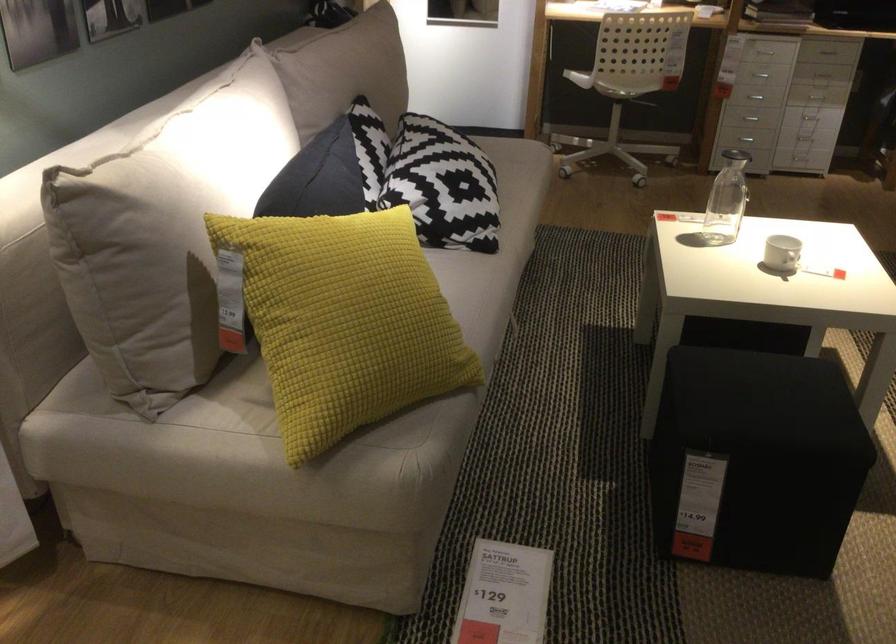
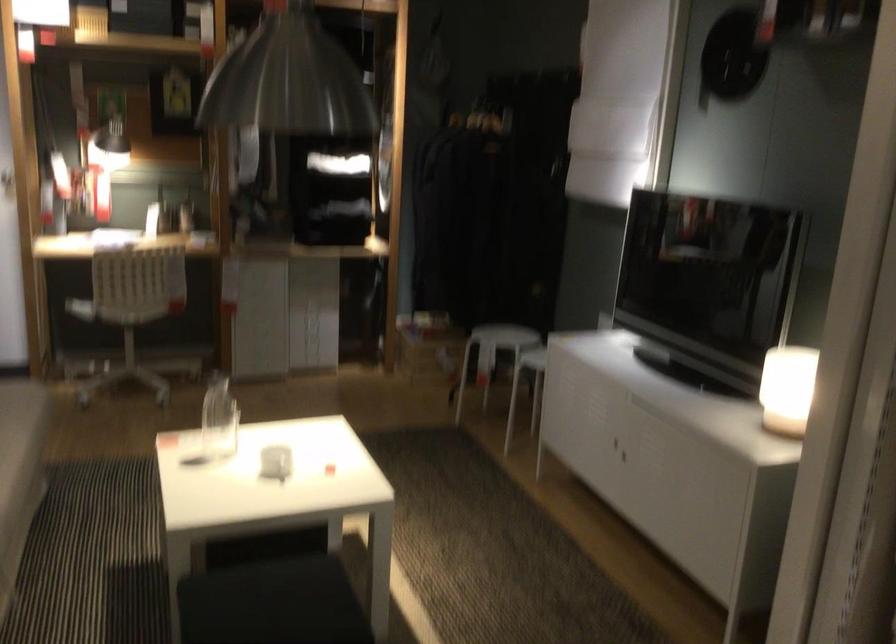
Where in the second image is the point corresponding to point 761,390 from the first image?

(271, 603)